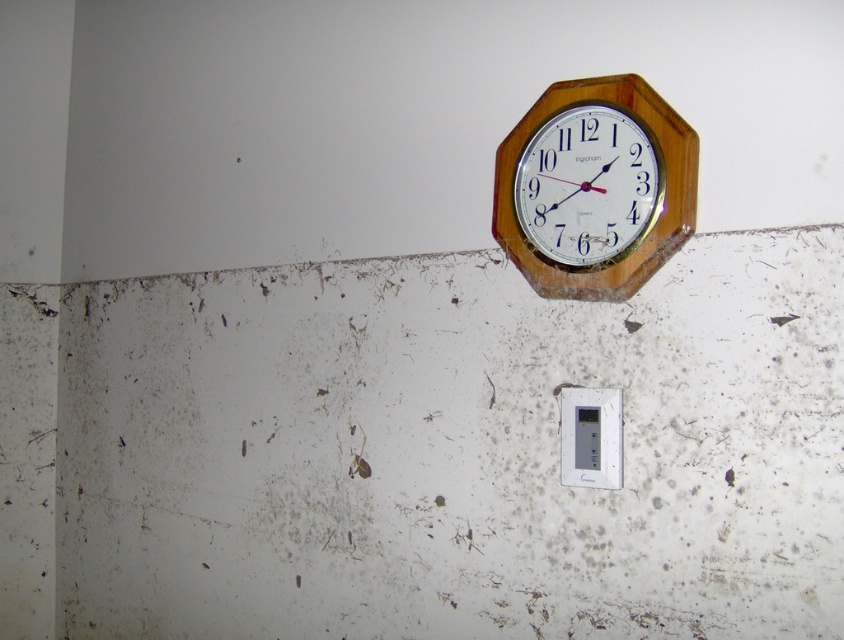
You are an electrician trying to fix the outlet. You need to reach the white plastic electric outlet at center. Is the wooden clock at upper right blocking your access to it?

The wooden clock at upper right is closer to the viewer than the white plastic electric outlet at center, so the clock is in front of the outlet. Therefore, the wooden clock at upper right is blocking access to the white plastic electric outlet at center.

You are a painter standing 1.2 meters away from the wall. You want to paint the wooden clock at upper right but need to step back to ensure you can paint it without getting too close. Do you need to move further back?

The wooden clock at upper right is 1.18 meters from the camera. Since you are already standing 1.2 meters away, you are slightly farther back than the clock, so you don not need to move further back to paint it.

You are standing at a point 4.05 feet away from the point labeled point (636, 92). The wall has a clock mounted on it. Can you estimate how far you are from the clock?

The point labeled point (636, 92) is 4.05 feet away from the viewer, so the distance between the viewer and the clock is approximately 4.05 feet.